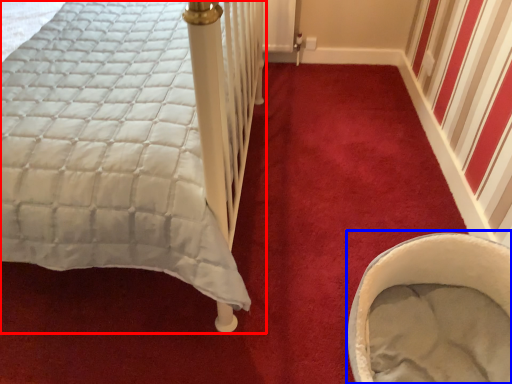
Question: Which object is further to the camera taking this photo, bed (highlighted by a red box) or baby carriage (highlighted by a blue box)?

Choices:
 (A) bed
 (B) baby carriage

Answer: (B)